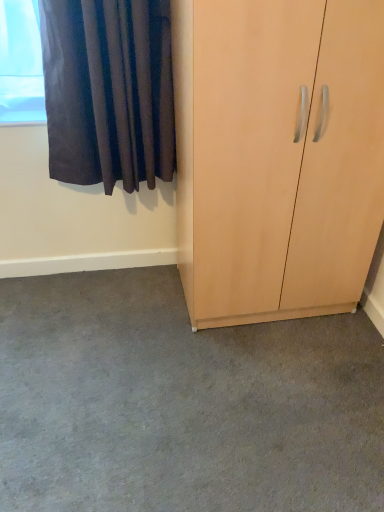
Question: Is point 249,31 positioned closer to the camera than point 9,483?

Choices:
 (A) farther
 (B) closer

Answer: (B)

Question: From the image's perspective, is light wood cupboard at right positioned above or below gray carpet at lower center?

Choices:
 (A) below
 (B) above

Answer: (B)

Question: Which is farther from the gray carpet at lower center?

Choices:
 (A) light wood cupboard at right
 (B) dark velvet curtain at upper left

Answer: (B)

Question: Considering the real-world distances, which object is closest to the dark velvet curtain at upper left?

Choices:
 (A) gray carpet at lower center
 (B) light wood cupboard at right

Answer: (B)